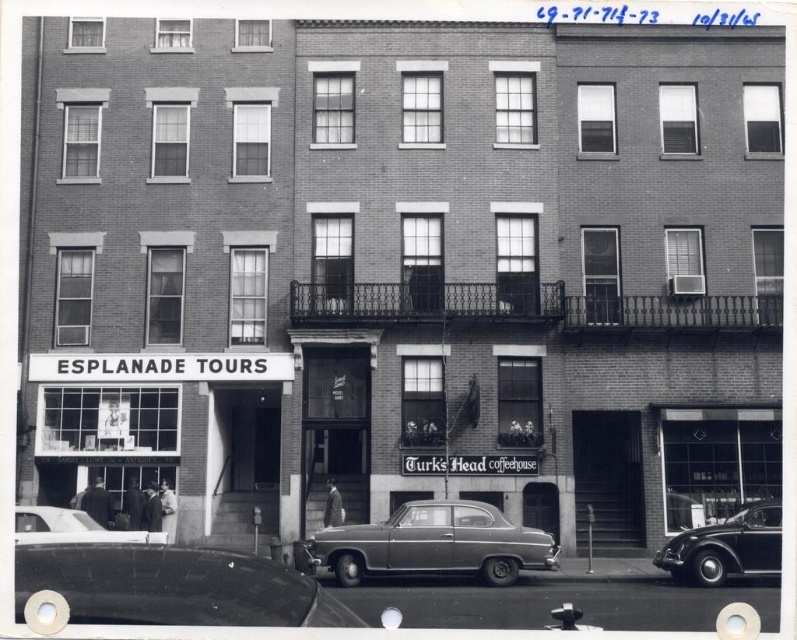
You are a pedestrian standing in front of the building. You need to cross the street but want to avoid walking in front of the shiny black sedan at lower left and the white glossy sedan at lower left. Which car should you walk around to stay closer to the building?

The shiny black sedan at lower left is closer to the viewer than the white glossy sedan at lower left, so you should walk around the white glossy sedan at lower left to stay closer to the building.

Based on the photo, what is the exact coordinate of the metallic gray sedan at center?

The metallic gray sedan at center is located at coordinate point (434,545).

You are driving a car that is 2.5 meters long and need to park between the metallic gray sedan at center and the shiny black car at lower right. Is there enough space for your car?

The metallic gray sedan at center is 3.38 meters away from the shiny black car at lower right. Since your car is 2.5 meters long, there is sufficient space to park between them.